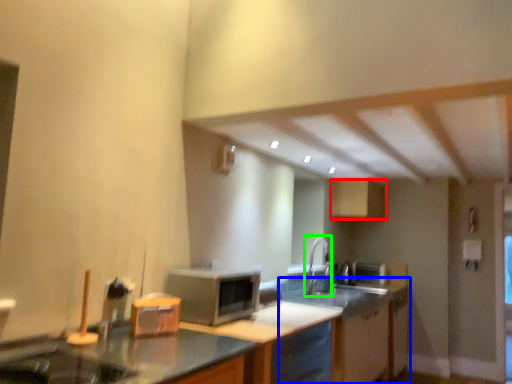
Question: Estimate the real-world distances between objects in this image. Which object is farther from cabinetry (highlighted by a red box), cabinetry (highlighted by a blue box) or faucet (highlighted by a green box)?

Choices:
 (A) cabinetry
 (B) faucet

Answer: (A)